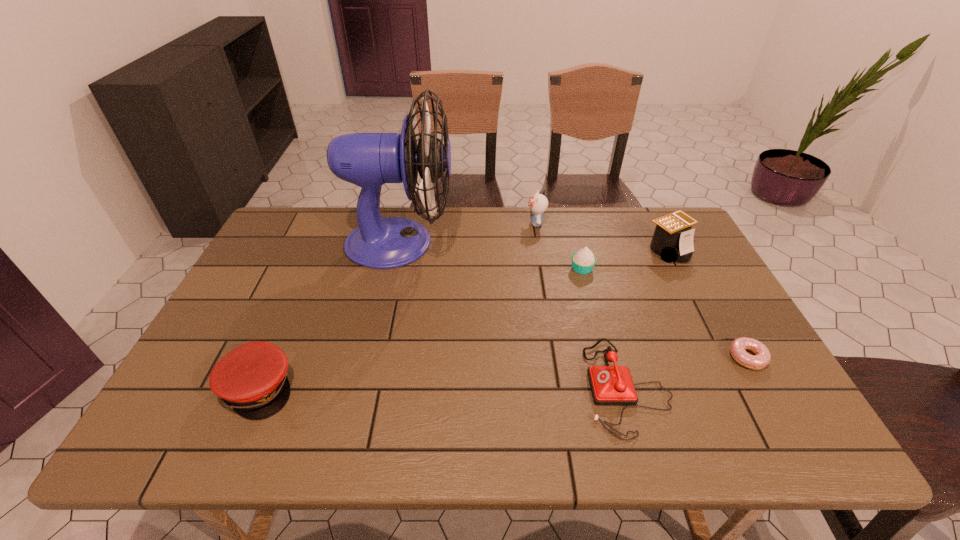
This screenshot has width=960, height=540. I want to click on blank space at the left edge of the desktop, so click(x=301, y=273).

Locate an element on the screen. blank space at the right edge of the desktop is located at coordinates (691, 332).

The image size is (960, 540). In the image, there is a desktop. Find the location of `vacant space at the far left corner`. vacant space at the far left corner is located at coordinates (306, 228).

In the image, there is a desktop. At what (x,y) coordinates should I click in order to perform the action: click on free space at the far right corner. Please return your answer as a coordinate pair (x, y). Image resolution: width=960 pixels, height=540 pixels. Looking at the image, I should click on (654, 212).

What are the coordinates of `vacant space at the near right corner` in the screenshot? It's located at (732, 423).

The image size is (960, 540). What are the coordinates of `unoccupied area between the fan and the cap` in the screenshot? It's located at (329, 315).

Find the location of a particular element. Image resolution: width=960 pixels, height=540 pixels. free area in between the telephone and the doughnut is located at coordinates (687, 372).

The height and width of the screenshot is (540, 960). I want to click on free spot between the cap and the fifth object from right to left, so click(397, 306).

The width and height of the screenshot is (960, 540). In order to click on free space between the fifth object from right to left and the cupcake in this screenshot , I will do `click(559, 246)`.

The width and height of the screenshot is (960, 540). Identify the location of vacant space that is in between the cap and the telephone. (443, 388).